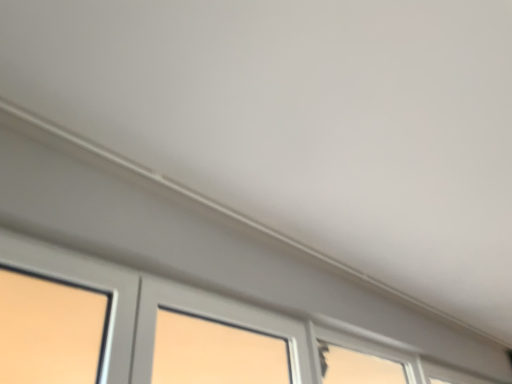
Question: In terms of width, does clear glass window at lower right, arranged as the 1th window when viewed from the right, look wider or thinner when compared to transparent glass window at lower right, the second window viewed from the left?

Choices:
 (A) wide
 (B) thin

Answer: (B)

Question: Is point (466, 372) positioned closer to the camera than point (401, 357)?

Choices:
 (A) closer
 (B) farther

Answer: (B)

Question: Which is farther from the clear glass window at lower right, marked as the 3th window in a front-to-back arrangement?

Choices:
 (A) transparent glass window at lower right, which ranks as the second window in back-to-front order
 (B) matte gray window at lower left, the third window from the back

Answer: (A)

Question: Which is farther from the clear glass window at lower right, marked as the 3th window in a front-to-back arrangement?

Choices:
 (A) matte gray window at lower left, the 3th window viewed from the right
 (B) transparent glass window at lower right, the second window viewed from the left

Answer: (B)